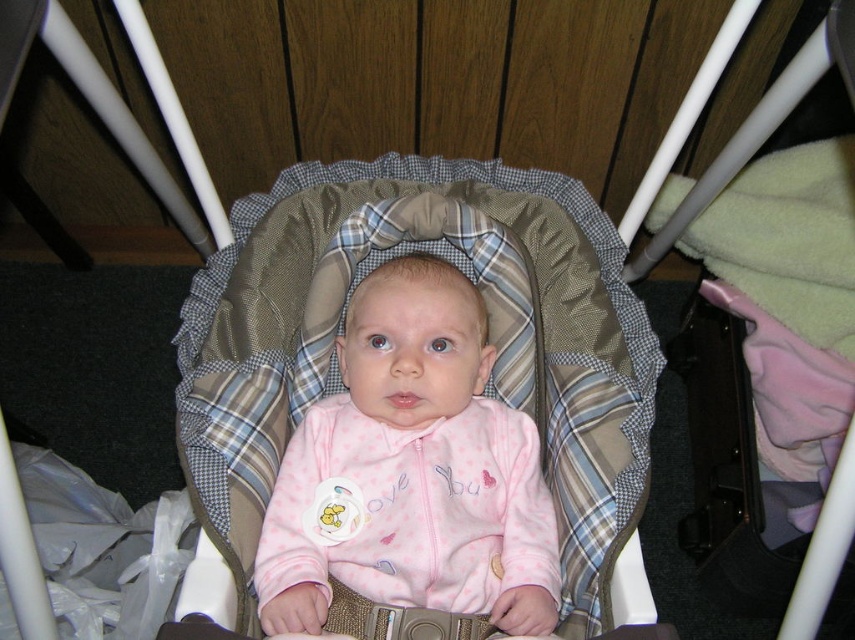
You are a parent trying to place a toy for your baby in the bassinet. The toy is 90 centimeters long. Can you fit the toy horizontally between the two points marked as point (219, 513)?

The distance between the two points is 89.92 centimeters. Since the toy is 90 centimeters long, it will not fit horizontally between them as it is slightly longer than the available space.

Based on the scene description, can you determine which object is bigger between the plaid fabric infant bed at center and the pink fleece baby at center?

The plaid fabric infant bed at center is larger in size than the pink fleece baby at center according to the description.